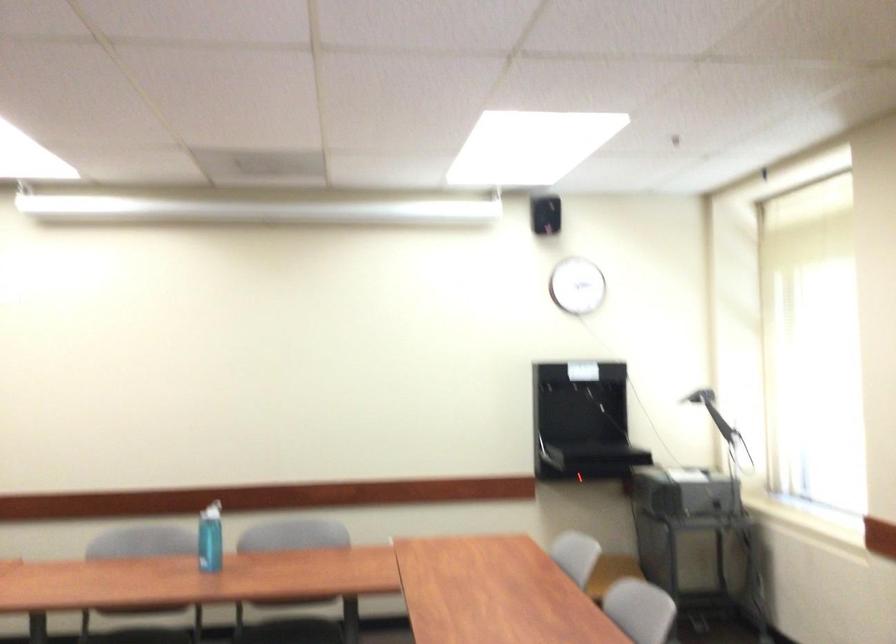
Locate an element on the screen. The image size is (896, 644). blue water bottle is located at coordinates pos(210,538).